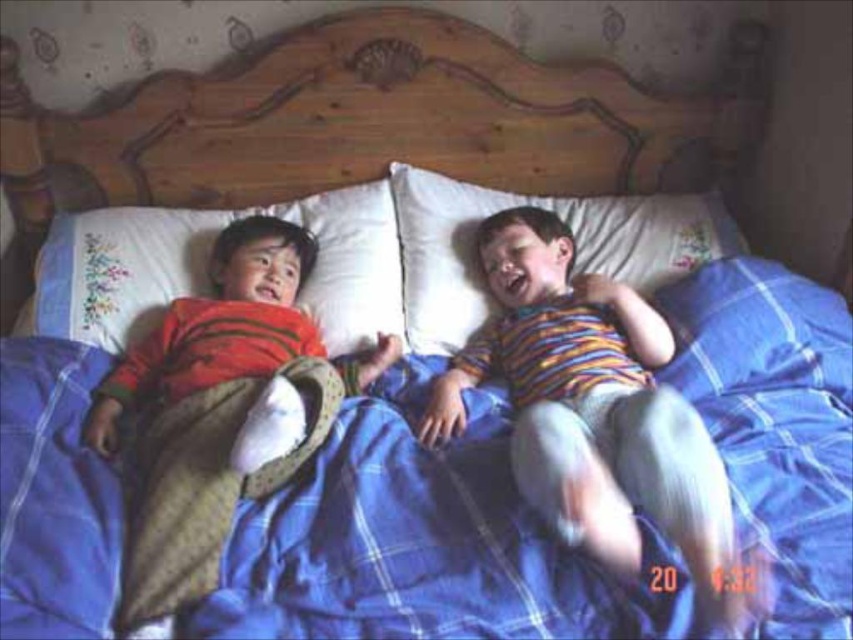
You are a parent checking on your children. You notice the blue plaid blanket at center and the matte orange shirt at left. Which item is taller in the image?

The matte orange shirt at left is taller than the blue plaid blanket at center.

You are a photographer taking a picture of the wooden headboard at upper center and the white embroidered pillow at upper left. Which object should you focus on first if you want to capture both in the same frame without moving the camera?

You should focus on the wooden headboard at upper center first because it is above the white embroidered pillow at upper left, so adjusting focus from top to bottom will ensure both are in frame.